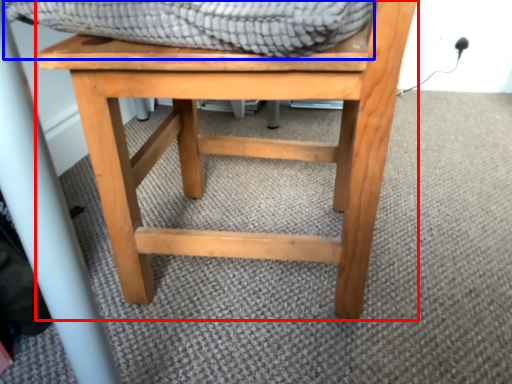
Question: Which of the following is the closest to the observer, stool (highlighted by a red box) or blanket (highlighted by a blue box)?

Choices:
 (A) stool
 (B) blanket

Answer: (B)